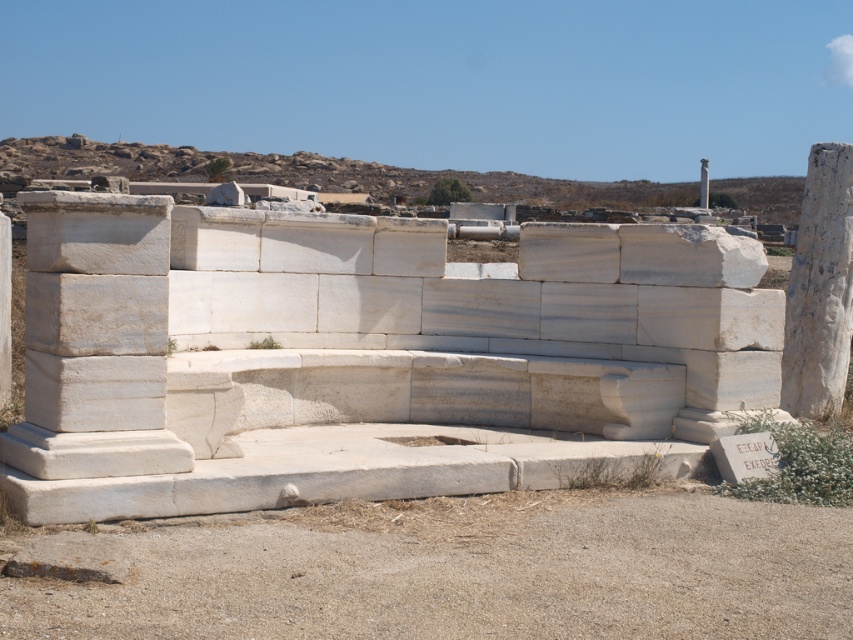
You are standing at the center of the archaeological site and want to locate the white marble pillar at left. According to the coordinates provided, in which direction should you move to find it?

The white marble pillar at left is located at coordinates point (4,308), which means you should move to the left side to find it.

In the scene shown: You are an archaeologist examining two white marble pillars at an ancient site. The pillars are labeled as the white marble pillar at left and the white marble pillar at center. Based on their positions and the surrounding structures, which pillar do you think is more likely to be part of the main entrance structure?

The white marble pillar at center is more likely to be part of the main entrance structure because it is thicker than the white marble pillar at left, suggesting it was a more significant structural component.

You are an archaeologist standing at the entrance of the site. You see the white marble pillar at right and the white marble pillar at center. Which pillar is positioned to the left of the other?

The white marble pillar at right is positioned to the left of the white marble pillar at center.